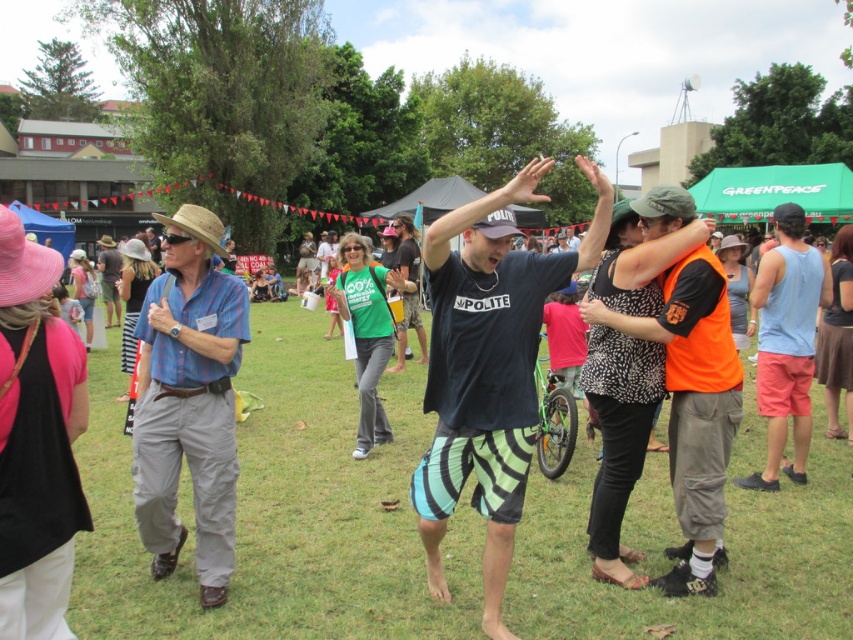
Question: Considering the relative positions of black cotton t-shirt at center and light blue tank top at right in the image provided, where is black cotton t-shirt at center located with respect to light blue tank top at right?

Choices:
 (A) left
 (B) right

Answer: (A)

Question: Among these points, which one is nearest to the camera?

Choices:
 (A) [x=195, y=378]
 (B) [x=335, y=456]
 (C) [x=764, y=353]

Answer: (A)

Question: Is green grass at center positioned behind light blue tank top at right?

Choices:
 (A) yes
 (B) no

Answer: (B)

Question: Which point is farther from the camera taking this photo?

Choices:
 (A) (759, 257)
 (B) (584, 560)
 (C) (494, 276)
 (D) (670, 346)

Answer: (A)

Question: Which object appears closest to the camera in this image?

Choices:
 (A) light blue tank top at right
 (B) black cotton t-shirt at center
 (C) orange reflective vest at center
 (D) green grass at center

Answer: (B)

Question: Considering the relative positions of green grass at center and blue plaid shirt at left in the image provided, where is green grass at center located with respect to blue plaid shirt at left?

Choices:
 (A) above
 (B) below

Answer: (B)